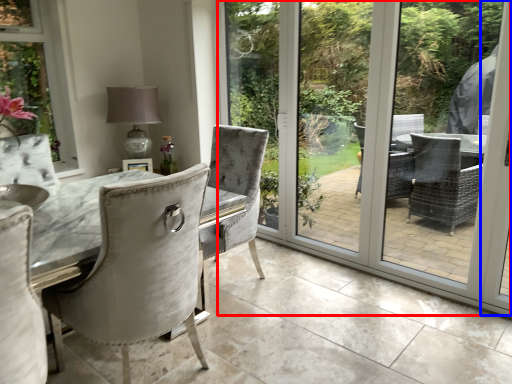
Question: Which object is closer to the camera taking this photo, screen door (highlighted by a red box) or screen door (highlighted by a blue box)?

Choices:
 (A) screen door
 (B) screen door

Answer: (A)